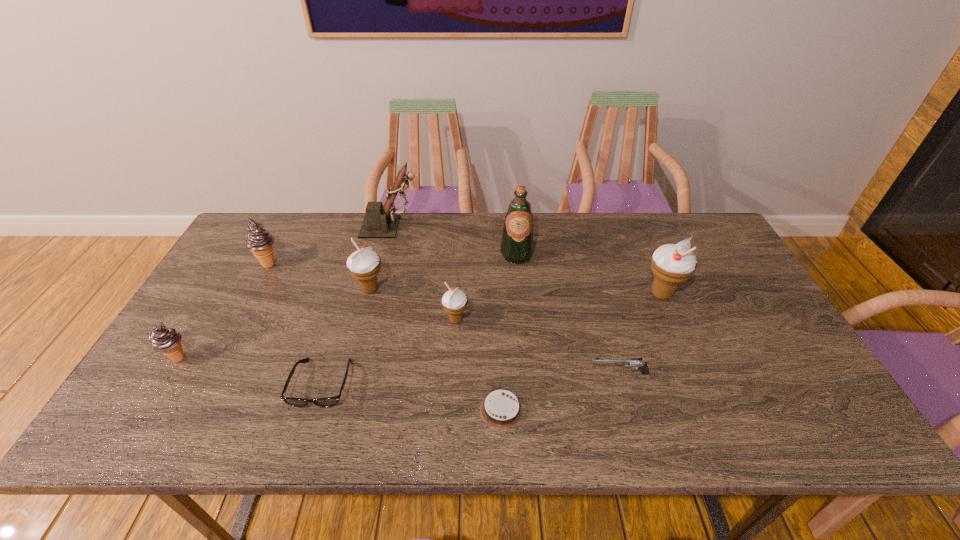
What are the coordinates of `vacant space located on the front of the farthest icecream` in the screenshot? It's located at (248, 303).

The height and width of the screenshot is (540, 960). I want to click on free space located 0.140m on the front of the third icecream from left to right, so click(357, 340).

Find the location of a particular element. This screenshot has width=960, height=540. free space located 0.230m on the right of the fourth icecream from left to right is located at coordinates (554, 320).

The width and height of the screenshot is (960, 540). In order to click on vacant area situated on the right of the nearer chocolate icecream in this screenshot , I will do 260,358.

Where is `free space located 0.350m on the front-facing side of the silver pistol`? free space located 0.350m on the front-facing side of the silver pistol is located at coordinates (444, 373).

The image size is (960, 540). In order to click on free region located 0.210m on the front-facing side of the silver pistol in this screenshot , I will do `click(502, 373)`.

You are a GUI agent. You are given a task and a screenshot of the screen. Output one action in this format:
    pyautogui.click(x=<x>, y=<y>)
    Task: Click on the vacant space located 0.050m on the front-facing side of the silver pistol
    The width and height of the screenshot is (960, 540).
    Given the screenshot: What is the action you would take?
    pyautogui.click(x=568, y=373)

At what (x,y) coordinates should I click in order to perform the action: click on free location located on the right of the shortest object. Please return your answer as a coordinate pair (x, y). Looking at the image, I should click on (679, 410).

You are a GUI agent. You are given a task and a screenshot of the screen. Output one action in this format:
    pyautogui.click(x=<x>, y=<y>)
    Task: Click on the figurine located in the far edge section of the desktop
    
    Given the screenshot: What is the action you would take?
    pyautogui.click(x=379, y=222)

The image size is (960, 540). Find the location of `olive oil positioned at the far edge`. olive oil positioned at the far edge is located at coordinates (517, 240).